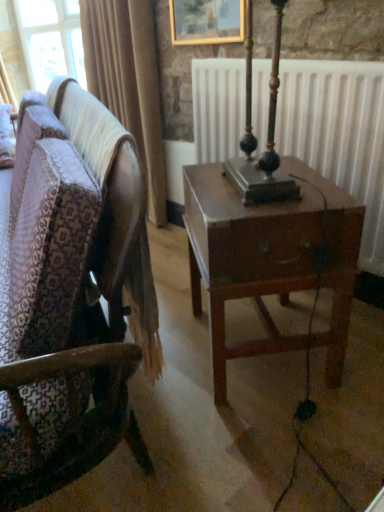
Question: From a real-world perspective, is white matte radiator at center positioned over wooden chair at center based on gravity?

Choices:
 (A) no
 (B) yes

Answer: (B)

Question: Is white matte radiator at center behind wooden chair at center?

Choices:
 (A) no
 (B) yes

Answer: (B)

Question: From the image's perspective, does white matte radiator at center appear lower than wooden chair at center?

Choices:
 (A) yes
 (B) no

Answer: (B)

Question: Would you say white matte radiator at center is outside wooden chair at center?

Choices:
 (A) yes
 (B) no

Answer: (A)

Question: Is white matte radiator at center at the left side of wooden chair at center?

Choices:
 (A) yes
 (B) no

Answer: (B)

Question: Is white matte radiator at center beside wooden chair at center?

Choices:
 (A) yes
 (B) no

Answer: (B)

Question: Is white matte radiator at center completely or partially outside of gold-framed painting at upper center?

Choices:
 (A) no
 (B) yes

Answer: (B)

Question: Considering the relative positions of white matte radiator at center and gold-framed painting at upper center in the image provided, is white matte radiator at center in front of gold-framed painting at upper center?

Choices:
 (A) yes
 (B) no

Answer: (A)

Question: From a real-world perspective, is white matte radiator at center located beneath gold-framed painting at upper center?

Choices:
 (A) yes
 (B) no

Answer: (A)

Question: Considering the relative positions of white matte radiator at center and gold-framed painting at upper center in the image provided, is white matte radiator at center to the right of gold-framed painting at upper center from the viewer's perspective?

Choices:
 (A) yes
 (B) no

Answer: (A)

Question: Does white matte radiator at center contain gold-framed painting at upper center?

Choices:
 (A) yes
 (B) no

Answer: (B)

Question: Does white matte radiator at center have a larger size compared to gold-framed painting at upper center?

Choices:
 (A) yes
 (B) no

Answer: (A)

Question: Considering the relative sizes of wooden chair at center and gold-framed painting at upper center in the image provided, is wooden chair at center smaller than gold-framed painting at upper center?

Choices:
 (A) no
 (B) yes

Answer: (A)